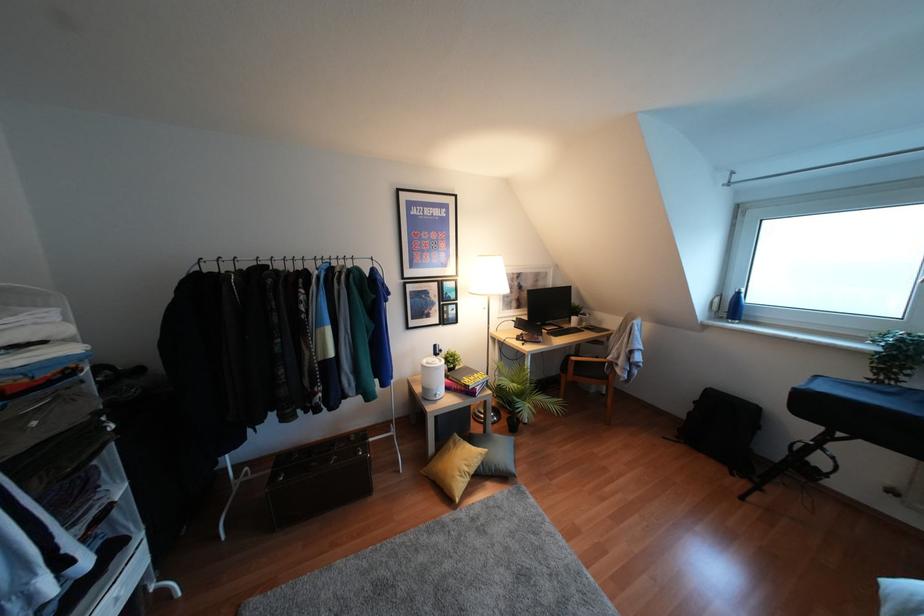
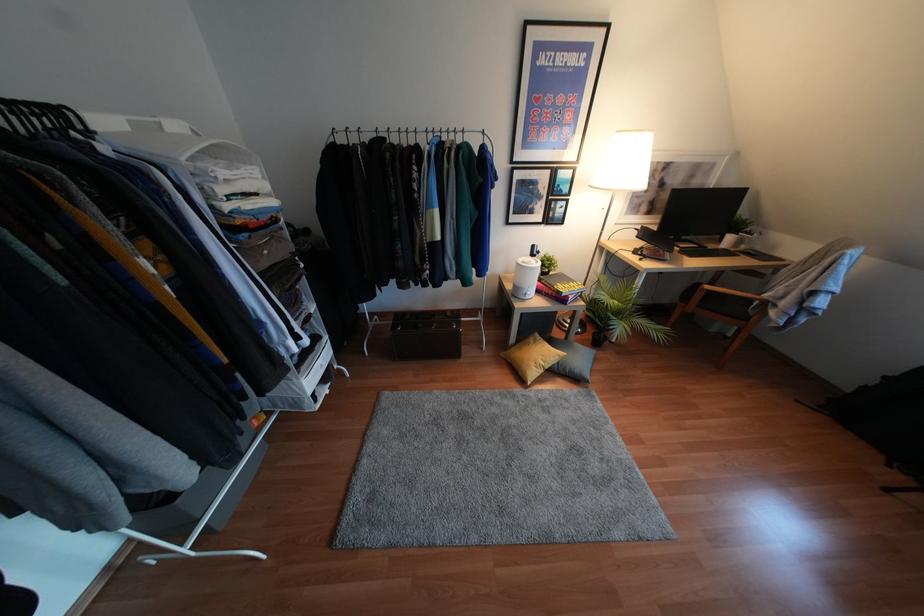
Locate, in the second image, the point that corresponds to (573,358) in the first image.

(707, 286)